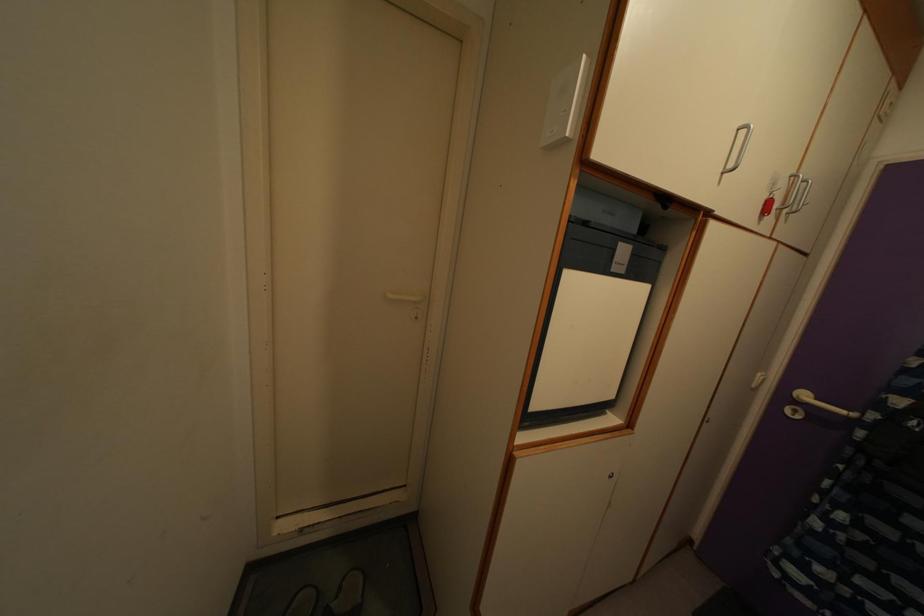
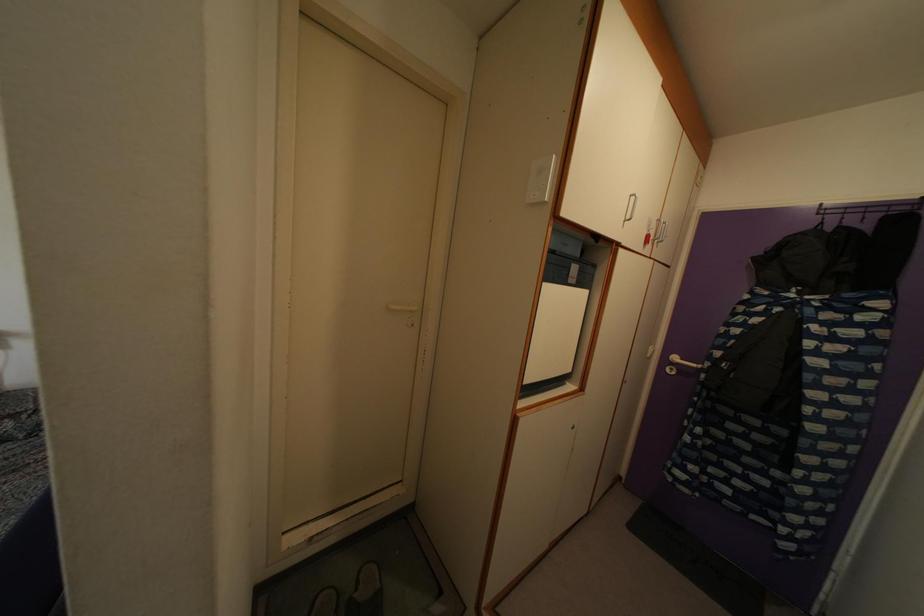
Locate, in the second image, the point that corresponds to pixel 746 140 in the first image.

(636, 206)